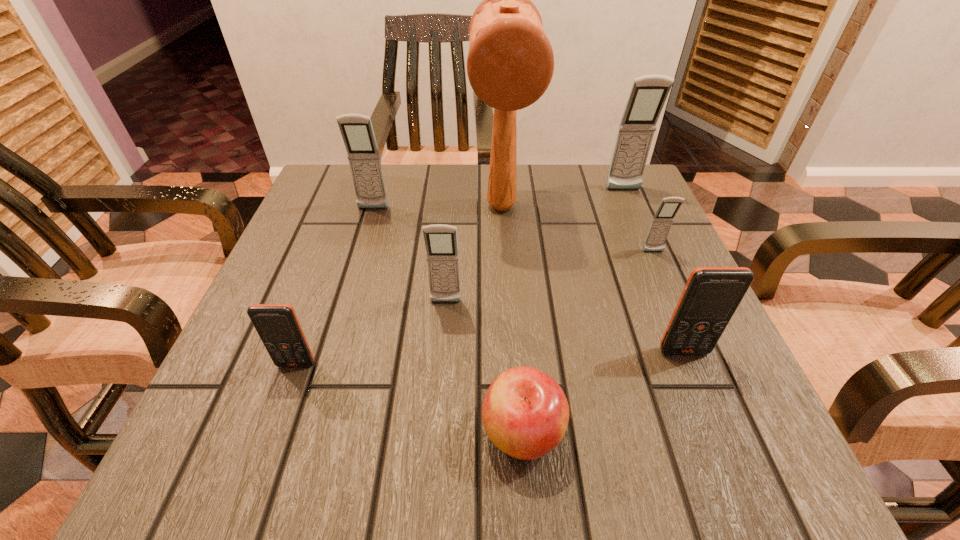
Locate an element on the screen. The width and height of the screenshot is (960, 540). free space located on the screen of the nearer orange cellular telephone is located at coordinates (284, 397).

The width and height of the screenshot is (960, 540). Identify the location of vacant space situated 0.380m on the front-facing side of the smallest gray cellular telephone. (733, 437).

This screenshot has width=960, height=540. In order to click on vacant space located on the right of the apple in this screenshot , I will do `click(708, 432)`.

The height and width of the screenshot is (540, 960). I want to click on mallet that is at the far edge, so click(510, 63).

I want to click on object located at the near edge, so (x=525, y=413).

At what (x,y) coordinates should I click in order to perform the action: click on object that is at the far left corner. Please return your answer as a coordinate pair (x, y). This screenshot has width=960, height=540. Looking at the image, I should click on (357, 132).

Locate an element on the screen. The image size is (960, 540). object present at the far right corner is located at coordinates (648, 94).

What are the coordinates of `free space at the far edge of the desktop` in the screenshot? It's located at (522, 171).

Identify the location of vacant space at the near edge. [x=420, y=446].

Where is `free spot at the left edge of the desktop`? The width and height of the screenshot is (960, 540). free spot at the left edge of the desktop is located at coordinates (279, 398).